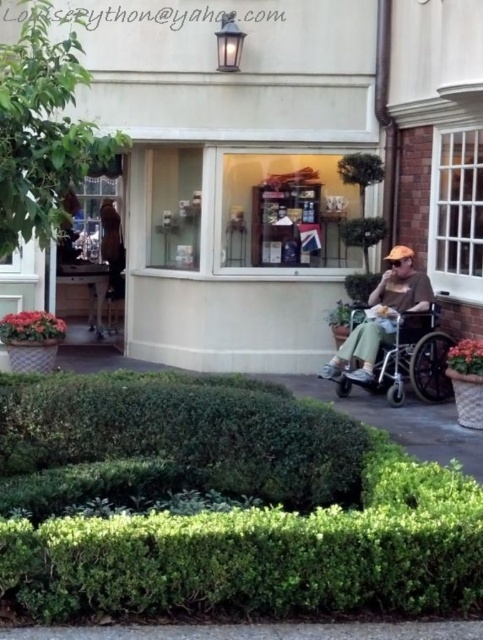
Question: Which point is closer to the camera?

Choices:
 (A) green leafy hedge at center
 (B) matte brown shirt at right
 (C) silver metallic wheelchair at right
 (D) green leafy hedge at lower center

Answer: (D)

Question: Which object is the closest to the green leafy hedge at lower center?

Choices:
 (A) silver metallic wheelchair at right
 (B) green leafy hedge at center

Answer: (B)

Question: Does green leafy hedge at center have a larger size compared to matte brown shirt at right?

Choices:
 (A) yes
 (B) no

Answer: (A)

Question: Based on their relative distances, which object is farther from the green leafy hedge at lower center?

Choices:
 (A) matte brown shirt at right
 (B) silver metallic wheelchair at right
 (C) green leafy hedge at center

Answer: (A)

Question: Considering the relative positions of green leafy hedge at lower center and green leafy hedge at center in the image provided, where is green leafy hedge at lower center located with respect to green leafy hedge at center?

Choices:
 (A) below
 (B) above

Answer: (A)

Question: Can you confirm if green leafy hedge at center is positioned below matte brown shirt at right?

Choices:
 (A) no
 (B) yes

Answer: (B)